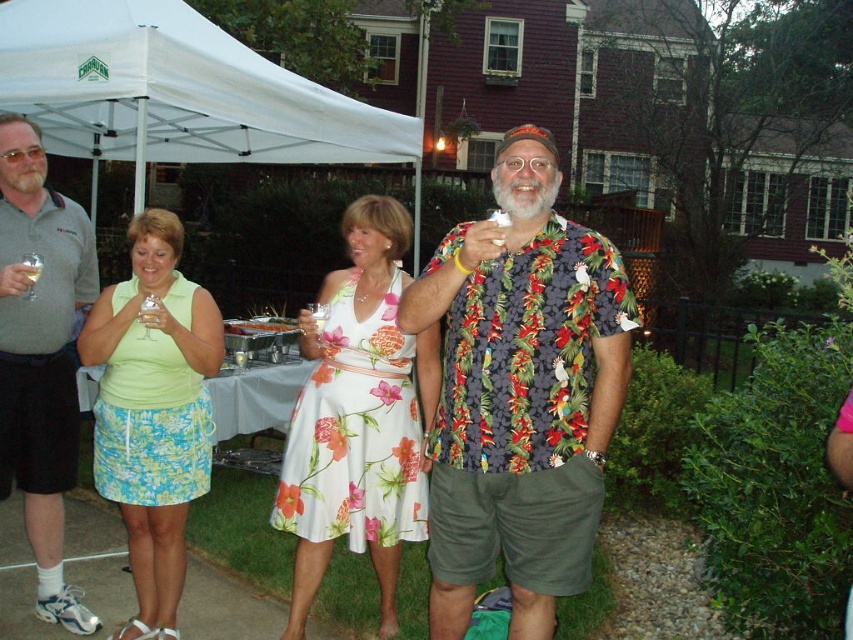
You are planning to take a photo of the lime green fabric skirt at left and the gray polo shirt at center. The camera you are using has a minimum focus distance of 15 inches. Can you capture both subjects in focus without moving either of them?

The lime green fabric skirt at left is 14.71 inches from gray polo shirt at center. Since the distance between them is less than the camera minimum focus distance of 15 inches, you cannot capture both subjects in focus without moving them.

In the scene shown: What color is the skirt located at point [154,412]?

The skirt at point [154,412] is lime green.